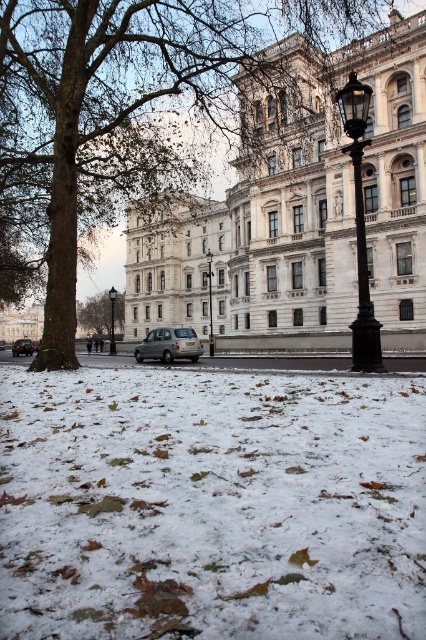
You are standing in front of the grand neoclassical building and want to take a photo. You notice two points marked in the scene. Which point is closer to your camera lens, point (212, 353) or point (112, 346)?

Point (212, 353) is closer to the camera lens than point (112, 346).

You are standing in front of the grand neoclassical building and want to take a photo. You notice two points marked in the scene. The first point is at coordinates point (239,179), and the second is at point (112,330). Which of these points is closer to your current position?

Point (239,179) is closer to the camera than point (112,330), so the first point is closer to your current position.